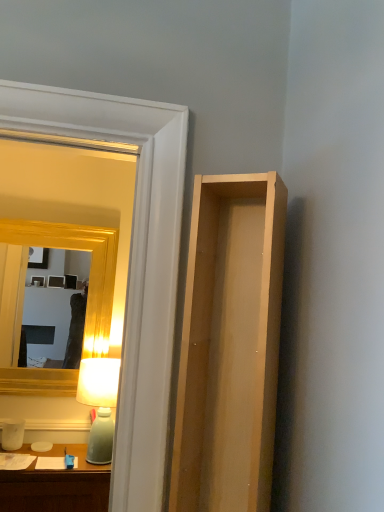
Question: Is matte green glass table lamp at left inside clear glass door at upper left?

Choices:
 (A) no
 (B) yes

Answer: (A)

Question: Is clear glass door at upper left not inside matte green glass table lamp at left?

Choices:
 (A) no
 (B) yes

Answer: (B)

Question: Does clear glass door at upper left have a greater height compared to matte green glass table lamp at left?

Choices:
 (A) no
 (B) yes

Answer: (B)

Question: Is clear glass door at upper left further to the viewer compared to matte green glass table lamp at left?

Choices:
 (A) no
 (B) yes

Answer: (A)

Question: From a real-world perspective, is clear glass door at upper left physically above matte green glass table lamp at left?

Choices:
 (A) yes
 (B) no

Answer: (A)

Question: Is matte green glass table lamp at left inside the boundaries of clear glass door at upper left, or outside?

Choices:
 (A) outside
 (B) inside

Answer: (A)

Question: From the image's perspective, relative to clear glass door at upper left, is matte green glass table lamp at left above or below?

Choices:
 (A) above
 (B) below

Answer: (B)

Question: Is matte green glass table lamp at left bigger or smaller than clear glass door at upper left?

Choices:
 (A) big
 (B) small

Answer: (B)

Question: Is point (102, 384) positioned closer to the camera than point (139, 475)?

Choices:
 (A) closer
 (B) farther

Answer: (B)

Question: Looking at the image, does gold wooden mirror at upper left seem bigger or smaller compared to matte green glass table lamp at left?

Choices:
 (A) big
 (B) small

Answer: (A)

Question: Considering the positions of gold wooden mirror at upper left and matte green glass table lamp at left in the image, is gold wooden mirror at upper left taller or shorter than matte green glass table lamp at left?

Choices:
 (A) tall
 (B) short

Answer: (A)

Question: Based on their positions, is gold wooden mirror at upper left located to the left or right of matte green glass table lamp at left?

Choices:
 (A) right
 (B) left

Answer: (B)

Question: Choose the correct answer: Is gold wooden mirror at upper left inside matte green glass table lamp at left or outside it?

Choices:
 (A) inside
 (B) outside

Answer: (B)

Question: Does point (248, 408) appear closer or farther from the camera than point (89, 391)?

Choices:
 (A) closer
 (B) farther

Answer: (A)

Question: Visually, is light wood cabinet at right positioned to the left or to the right of matte green glass table lamp at left?

Choices:
 (A) left
 (B) right

Answer: (B)